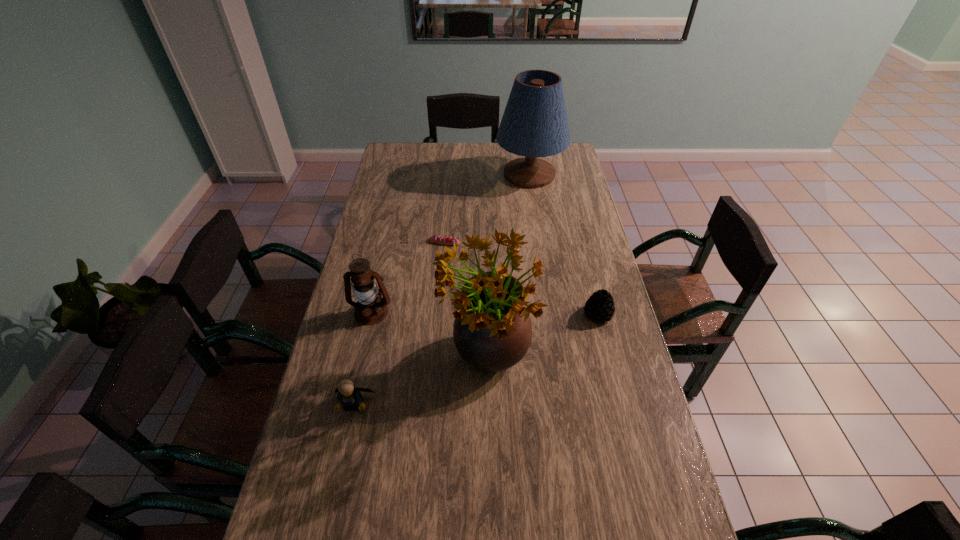
Locate an element on the screen. vacant space at the left edge of the desktop is located at coordinates (313, 468).

Locate an element on the screen. This screenshot has width=960, height=540. free spot at the right edge of the desktop is located at coordinates (567, 222).

The image size is (960, 540). Find the location of `vacant space at the far left corner of the desktop`. vacant space at the far left corner of the desktop is located at coordinates (415, 168).

At what (x,y) coordinates should I click in order to perform the action: click on vacant space in between the lampshade and the flower arrangement. Please return your answer as a coordinate pair (x, y). The image size is (960, 540). Looking at the image, I should click on (509, 268).

The width and height of the screenshot is (960, 540). I want to click on empty space between the Lego and the third tallest object, so click(x=363, y=359).

Locate an element on the screen. This screenshot has height=540, width=960. vacant area that lies between the flower arrangement and the Lego is located at coordinates (420, 383).

Identify the location of vacant area between the pinecone and the lampshade. (564, 244).

Where is `vacant region between the pinecone and the second farthest object`? vacant region between the pinecone and the second farthest object is located at coordinates (521, 278).

You are a GUI agent. You are given a task and a screenshot of the screen. Output one action in this format:
    pyautogui.click(x=<x>, y=<y>)
    Task: Click on the free spot between the flower arrangement and the Lego
    
    Given the screenshot: What is the action you would take?
    pyautogui.click(x=420, y=383)

In order to click on vacant space that is in between the pinecone and the flower arrangement in this screenshot , I will do `click(542, 338)`.